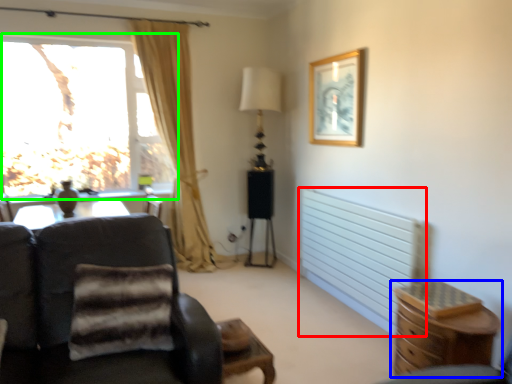
Question: Estimate the real-world distances between objects in this image. Which object is farther from radiator (highlighted by a red box), chest of drawers (highlighted by a blue box) or window (highlighted by a green box)?

Choices:
 (A) chest of drawers
 (B) window

Answer: (B)